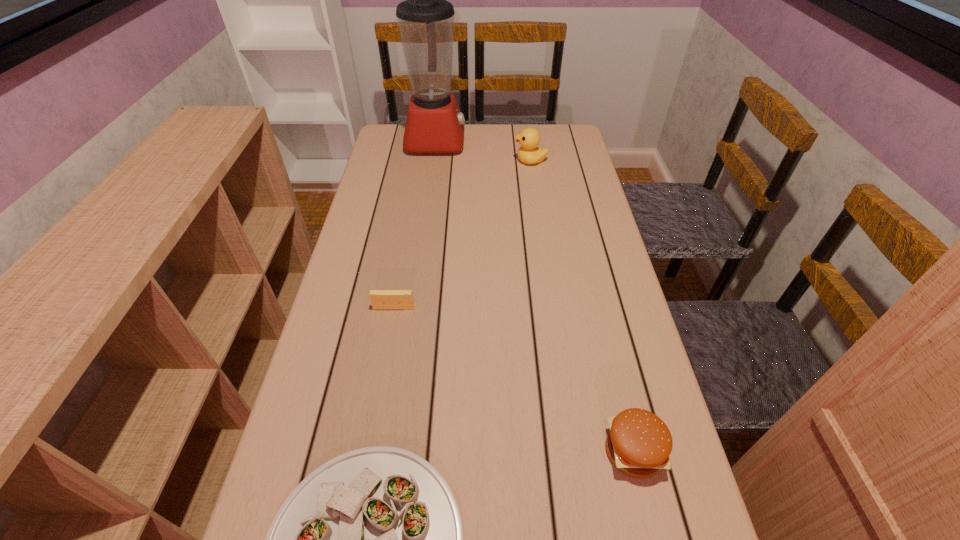
The image size is (960, 540). In order to click on free spot that satisfies the following two spatial constraints: 1. on the front of the hamburger near the controls; 2. on the right side of the tallest object in this screenshot , I will do `click(393, 451)`.

You are a GUI agent. You are given a task and a screenshot of the screen. Output one action in this format:
    pyautogui.click(x=<x>, y=<y>)
    Task: Click on the vacant space that satisfies the following two spatial constraints: 1. on the face of the fourth shortest object; 2. on the right side of the hamburger
    The image size is (960, 540).
    Given the screenshot: What is the action you would take?
    pyautogui.click(x=573, y=451)

Locate an element on the screen. This screenshot has width=960, height=540. vacant space that satisfies the following two spatial constraints: 1. on the face of the duck; 2. at the front of the third farthest object with spools is located at coordinates (552, 308).

The height and width of the screenshot is (540, 960). What are the coordinates of `vacant region that satisfies the following two spatial constraints: 1. on the front of the blender near the controls; 2. on the left side of the third shortest object` in the screenshot? It's located at (393, 451).

Identify the location of free point that satisfies the following two spatial constraints: 1. on the front of the tallest object near the controls; 2. on the right side of the hamburger. Image resolution: width=960 pixels, height=540 pixels. (393, 451).

Identify the location of vacant point that satisfies the following two spatial constraints: 1. on the face of the second object from right to left; 2. on the back side of the third shortest object. The width and height of the screenshot is (960, 540). (573, 451).